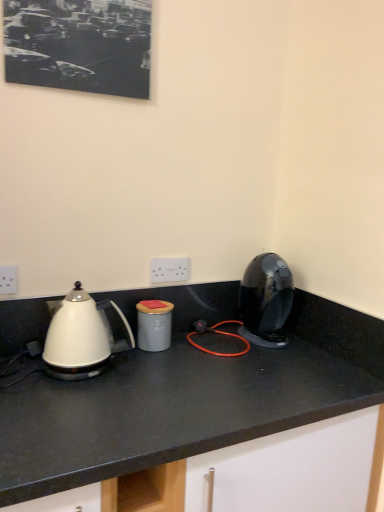
Question: Is black matte picture frame at upper left aimed at white glossy countertop at center?

Choices:
 (A) yes
 (B) no

Answer: (B)

Question: Can we say black matte picture frame at upper left lies outside white glossy countertop at center?

Choices:
 (A) yes
 (B) no

Answer: (A)

Question: Can you confirm if black matte picture frame at upper left is positioned to the left of white glossy countertop at center?

Choices:
 (A) yes
 (B) no

Answer: (A)

Question: Can you confirm if black matte picture frame at upper left is taller than white glossy countertop at center?

Choices:
 (A) no
 (B) yes

Answer: (A)

Question: Would you say white glossy countertop at center is part of black matte picture frame at upper left's contents?

Choices:
 (A) no
 (B) yes

Answer: (A)

Question: Can you confirm if black matte picture frame at upper left is bigger than white glossy countertop at center?

Choices:
 (A) no
 (B) yes

Answer: (A)

Question: Is white plastic electric outlet at left, which is the 2th electric outlet from right to left, further to the viewer compared to shiny black coffee machine at right?

Choices:
 (A) yes
 (B) no

Answer: (B)

Question: From a real-world perspective, is white plastic electric outlet at left, the 2th electric outlet when ordered from back to front, positioned under shiny black coffee machine at right based on gravity?

Choices:
 (A) yes
 (B) no

Answer: (B)

Question: Is white plastic electric outlet at left, which is the 2th electric outlet from right to left, aimed at shiny black coffee machine at right?

Choices:
 (A) no
 (B) yes

Answer: (A)

Question: Would you say white plastic electric outlet at left, which ranks as the first electric outlet in left-to-right order, is outside shiny black coffee machine at right?

Choices:
 (A) yes
 (B) no

Answer: (A)

Question: Considering the relative positions of white plastic electric outlet at left, which is the 2th electric outlet from right to left, and shiny black coffee machine at right in the image provided, is white plastic electric outlet at left, which is the 2th electric outlet from right to left, to the right of shiny black coffee machine at right from the viewer's perspective?

Choices:
 (A) no
 (B) yes

Answer: (A)

Question: Is white plastic electric outlet at left, the 2th electric outlet when ordered from back to front, closer to the viewer compared to shiny black coffee machine at right?

Choices:
 (A) no
 (B) yes

Answer: (B)

Question: Is black matte picture frame at upper left shorter than gray matte canister at center?

Choices:
 (A) yes
 (B) no

Answer: (B)